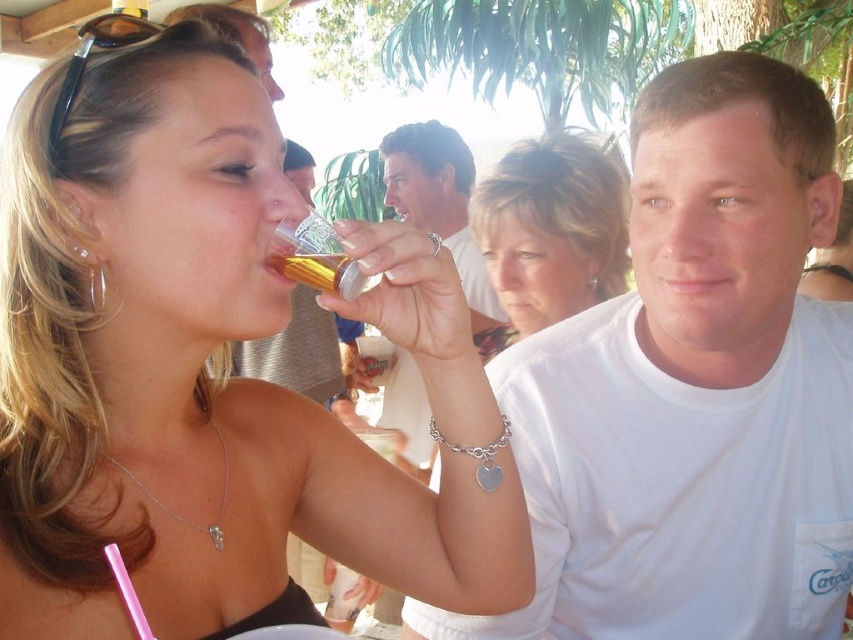
Question: Which point is farther to the camera?

Choices:
 (A) smooth silver ring at center
 (B) gold metallic can at upper center

Answer: (A)

Question: From the image, what is the correct spatial relationship of matte black glass at upper left in relation to gold metallic can at upper center?

Choices:
 (A) below
 (B) above

Answer: (A)

Question: Among these points, which one is nearest to the camera?

Choices:
 (A) (813, 288)
 (B) (228, 13)
 (C) (106, 38)

Answer: (C)

Question: Can you confirm if white matte t-shirt at center is thinner than black plastic sunglasses at upper left?

Choices:
 (A) no
 (B) yes

Answer: (A)

Question: Among these points, which one is farthest from the camera?

Choices:
 (A) (688, 369)
 (B) (811, 285)
 (C) (296, 408)

Answer: (B)

Question: Is smooth silver ring at center below black plastic sunglasses at upper left?

Choices:
 (A) no
 (B) yes

Answer: (B)